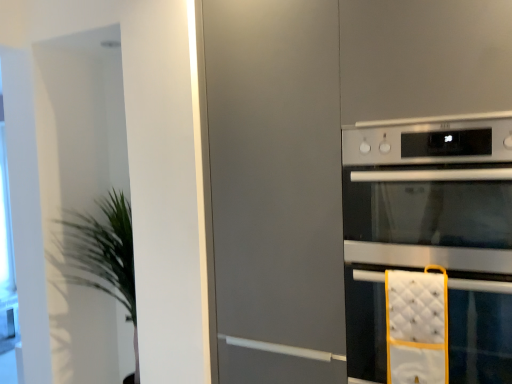
Question: Is satin silver oven at right completely or partially outside of silver metallic oven at right?

Choices:
 (A) no
 (B) yes

Answer: (B)

Question: From a real-world perspective, is satin silver oven at right under silver metallic oven at right?

Choices:
 (A) no
 (B) yes

Answer: (A)

Question: Would you say silver metallic oven at right is part of satin silver oven at right's contents?

Choices:
 (A) no
 (B) yes

Answer: (A)

Question: From the image's perspective, is satin silver oven at right located above silver metallic oven at right?

Choices:
 (A) no
 (B) yes

Answer: (B)

Question: Does satin silver oven at right have a lesser height compared to silver metallic oven at right?

Choices:
 (A) no
 (B) yes

Answer: (B)

Question: Is point (378, 311) positioned closer to the camera than point (470, 205)?

Choices:
 (A) farther
 (B) closer

Answer: (A)

Question: Looking at their shapes, would you say silver metallic oven at right is wider or thinner than satin silver oven at right?

Choices:
 (A) thin
 (B) wide

Answer: (A)

Question: Based on their sizes in the image, would you say silver metallic oven at right is bigger or smaller than satin silver oven at right?

Choices:
 (A) big
 (B) small

Answer: (A)

Question: Is silver metallic oven at right taller or shorter than satin silver oven at right?

Choices:
 (A) short
 (B) tall

Answer: (B)

Question: From a real-world perspective, is silver metallic oven at right physically located above or below green leafy plant at left?

Choices:
 (A) above
 (B) below

Answer: (A)

Question: Considering the positions of silver metallic oven at right and green leafy plant at left in the image, is silver metallic oven at right bigger or smaller than green leafy plant at left?

Choices:
 (A) small
 (B) big

Answer: (A)

Question: Is point (478, 306) closer or farther from the camera than point (73, 266)?

Choices:
 (A) closer
 (B) farther

Answer: (A)

Question: In terms of height, does silver metallic oven at right look taller or shorter compared to green leafy plant at left?

Choices:
 (A) short
 (B) tall

Answer: (A)

Question: Considering the positions of satin silver oven at right and green leafy plant at left in the image, is satin silver oven at right bigger or smaller than green leafy plant at left?

Choices:
 (A) small
 (B) big

Answer: (A)

Question: From their relative heights in the image, would you say satin silver oven at right is taller or shorter than green leafy plant at left?

Choices:
 (A) short
 (B) tall

Answer: (A)